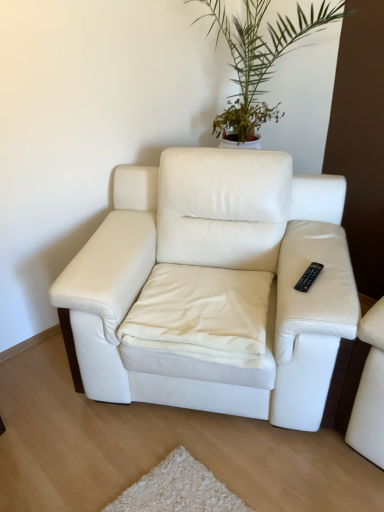
Question: Should I look upward or downward to see white leather armchair at center?

Choices:
 (A) up
 (B) down

Answer: (B)